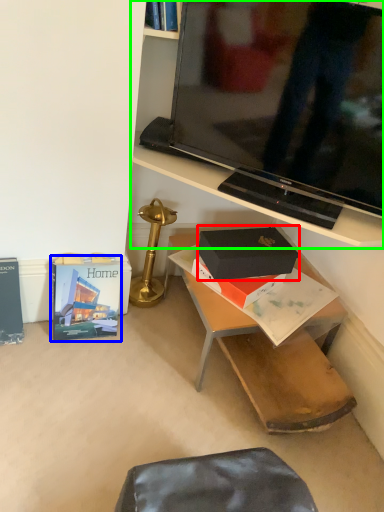
Question: Which object is positioned closest to box (highlighted by a red box)? Select from paperback book (highlighted by a blue box) and shelf (highlighted by a green box).

Choices:
 (A) paperback book
 (B) shelf

Answer: (B)